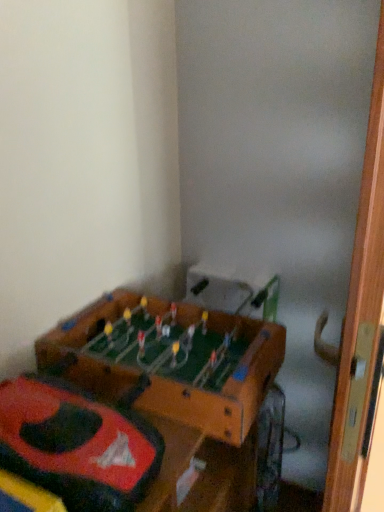
Question: Is wooden foosball table at lower left looking in the opposite direction of wooden door at right?

Choices:
 (A) yes
 (B) no

Answer: (B)

Question: Does wooden foosball table at lower left appear on the left side of wooden door at right?

Choices:
 (A) yes
 (B) no

Answer: (A)

Question: Does wooden foosball table at lower left come in front of wooden door at right?

Choices:
 (A) yes
 (B) no

Answer: (B)

Question: From the image's perspective, is wooden foosball table at lower left located beneath wooden door at right?

Choices:
 (A) no
 (B) yes

Answer: (A)

Question: Can you confirm if wooden foosball table at lower left is thinner than wooden door at right?

Choices:
 (A) no
 (B) yes

Answer: (A)

Question: In terms of height, does rubberized red car at lower left look taller or shorter compared to wooden door at right?

Choices:
 (A) short
 (B) tall

Answer: (A)

Question: In terms of size, does rubberized red car at lower left appear bigger or smaller than wooden door at right?

Choices:
 (A) small
 (B) big

Answer: (A)

Question: From the image's perspective, is rubberized red car at lower left positioned above or below wooden door at right?

Choices:
 (A) above
 (B) below

Answer: (A)

Question: From a real-world perspective, is rubberized red car at lower left physically located above or below wooden door at right?

Choices:
 (A) above
 (B) below

Answer: (A)

Question: In terms of size, does rubberized red car at lower left appear bigger or smaller than wooden foosball table at lower left?

Choices:
 (A) big
 (B) small

Answer: (B)

Question: Considering the positions of rubberized red car at lower left and wooden foosball table at lower left in the image, is rubberized red car at lower left taller or shorter than wooden foosball table at lower left?

Choices:
 (A) tall
 (B) short

Answer: (B)

Question: From the image's perspective, is rubberized red car at lower left above or below wooden foosball table at lower left?

Choices:
 (A) below
 (B) above

Answer: (A)

Question: Relative to wooden foosball table at lower left, is rubberized red car at lower left in front or behind?

Choices:
 (A) front
 (B) behind

Answer: (A)

Question: From their relative heights in the image, would you say wooden foosball table at lower left is taller or shorter than wooden door at right?

Choices:
 (A) short
 (B) tall

Answer: (A)

Question: Does point (139, 301) appear closer or farther from the camera than point (375, 328)?

Choices:
 (A) farther
 (B) closer

Answer: (A)